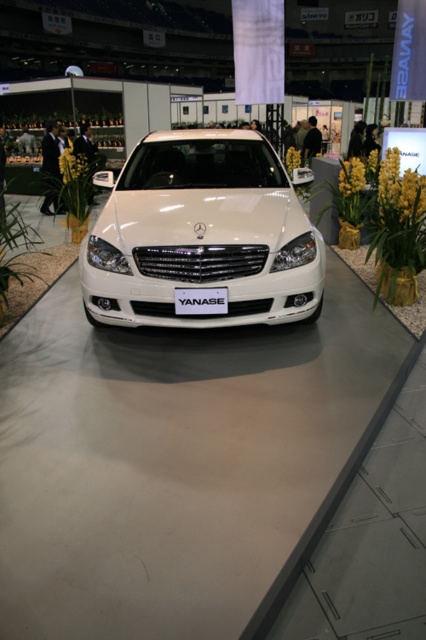
Is green leafy plant at left positioned in front of white plastic license plate at center?

No, green leafy plant at left is further to the viewer.

The image size is (426, 640). What do you see at coordinates (14, 260) in the screenshot? I see `green leafy plant at left` at bounding box center [14, 260].

At what (x,y) coordinates should I click in order to perform the action: click on green leafy plant at left. Please return your answer as a coordinate pair (x, y). The image size is (426, 640). Looking at the image, I should click on (14, 260).

Which is below, yellow textured plant at center right or white plastic license plate at center?

white plastic license plate at center

Which of these two, yellow textured plant at center right or white plastic license plate at center, stands taller?

Standing taller between the two is yellow textured plant at center right.

Describe the element at coordinates (397, 230) in the screenshot. I see `yellow textured plant at center right` at that location.

Locate an element on the screen. yellow textured plant at center right is located at coordinates (397, 230).

Is point (212, 243) positioned after point (5, 278)?

No, it is not.

Which is behind, point (80, 282) or point (2, 192)?

Positioned behind is point (2, 192).

Locate an element on the screen. The height and width of the screenshot is (640, 426). white glossy car at center is located at coordinates (203, 234).